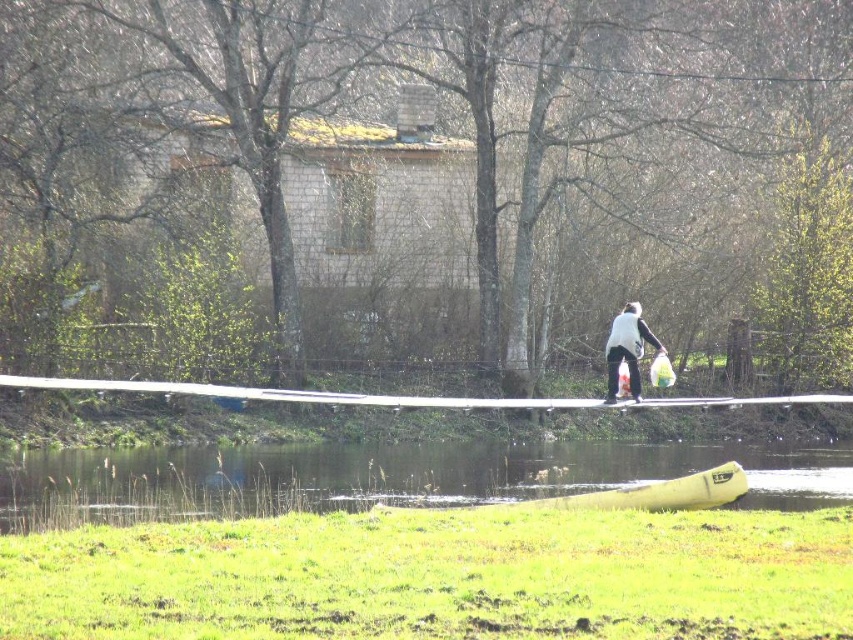
You are planning to take a photo of the green grass at lower center and the white matte vest at center. Which object should you zoom in on to capture more details of its texture?

The white matte vest at center is smaller than the green grass at lower center, so zooming in on the white matte vest at center would allow you to capture more details of its texture without losing focus.

You are standing at the point labeled as point (384, 476) in the image. What do you see directly below you?

The point labeled as point (384, 476) corresponds to green grass at lower center.